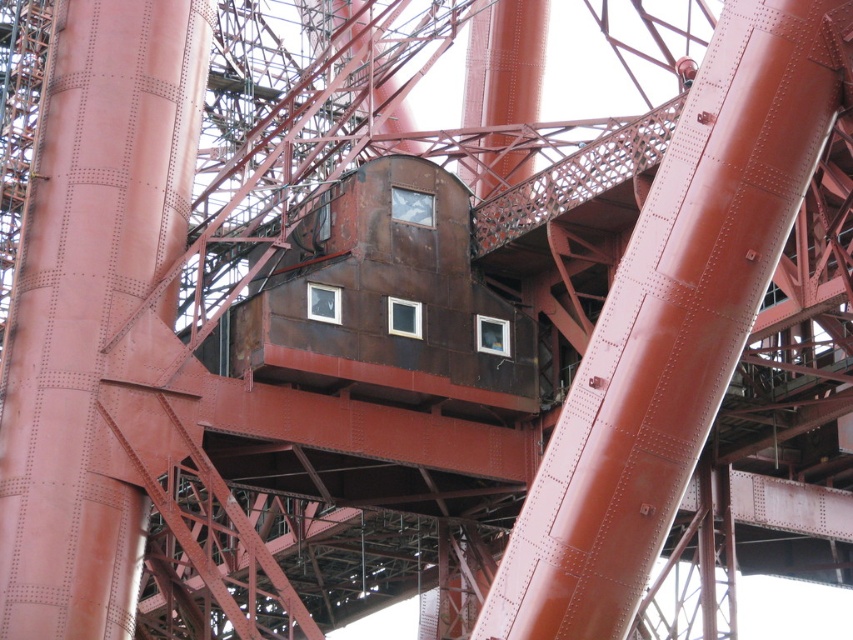
From the picture: Is rusty metal pole at center taller than rusty metal tower at center?

No.

Measure the distance between rusty metal pole at center and rusty metal tower at center.

24.43 meters

Is point (642, 268) farther from camera compared to point (149, 74)?

No.

Where is `rusty metal pole at center`? This screenshot has height=640, width=853. rusty metal pole at center is located at coordinates (669, 326).